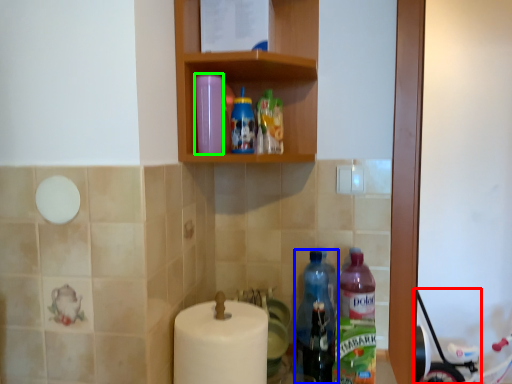
Question: Based on their relative distances, which object is nearer to baby carriage (highlighted by a red box)? Choose from bottle (highlighted by a blue box) and bottle (highlighted by a green box).

Choices:
 (A) bottle
 (B) bottle

Answer: (A)